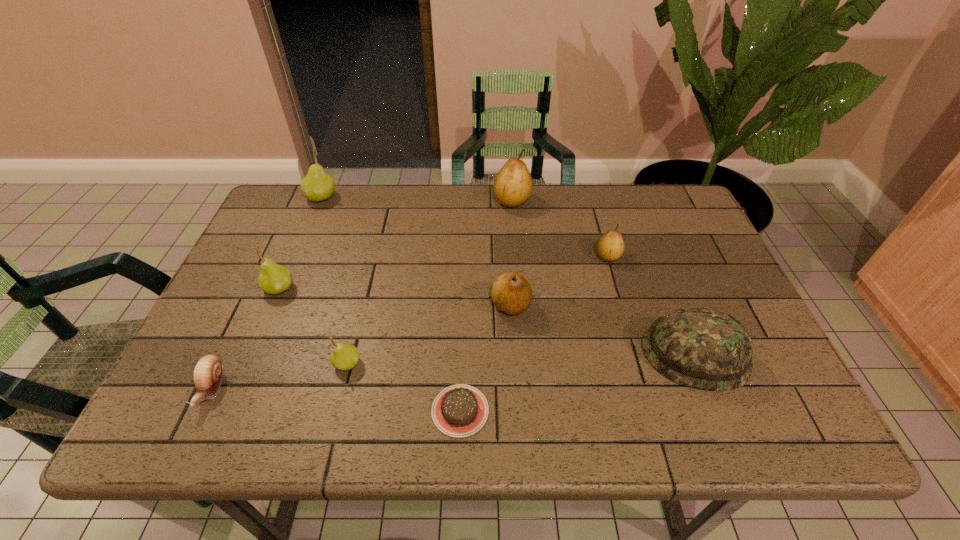
What are the coordinates of `free location at the near right corner of the desktop` in the screenshot? It's located at (764, 414).

Where is `vacant space that is in between the nearest brown pear and the farthest brown pear`? The height and width of the screenshot is (540, 960). vacant space that is in between the nearest brown pear and the farthest brown pear is located at coordinates (512, 253).

Locate an element on the screen. vacant area that lies between the biggest green pear and the rightmost green pear is located at coordinates (334, 280).

Locate an element on the screen. The image size is (960, 540). unoccupied position between the escargot and the headwear is located at coordinates (453, 372).

What are the coordinates of `free point between the second smallest green pear and the headwear` in the screenshot? It's located at (487, 321).

Find the location of a particular element. vacant area that lies between the farthest brown pear and the second smallest green pear is located at coordinates (396, 244).

Locate an element on the screen. Image resolution: width=960 pixels, height=540 pixels. free spot between the headwear and the second biggest green pear is located at coordinates (487, 321).

Locate an element on the screen. free space that is in between the eighth tallest object and the headwear is located at coordinates (453, 372).

You are a GUI agent. You are given a task and a screenshot of the screen. Output one action in this format:
    pyautogui.click(x=<x>, y=<y>)
    Task: Click on the vacant space in between the fourth object from left to right and the eighth tallest object
    
    Given the screenshot: What is the action you would take?
    pyautogui.click(x=279, y=376)

This screenshot has width=960, height=540. What are the coordinates of `vacant area between the nearest brown pear and the headwear` in the screenshot? It's located at (603, 330).